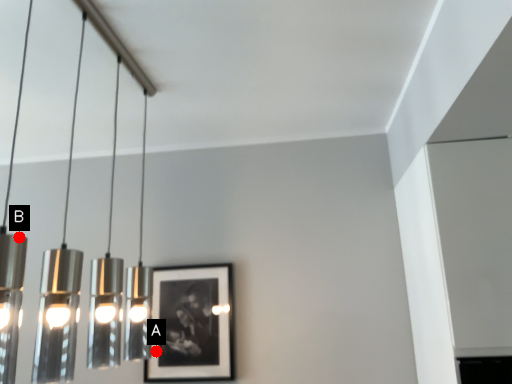
Question: Two points are circled on the image, labeled by A and B beside each circle. Which point is farther from the camera taking this photo?

Choices:
 (A) A is further
 (B) B is further

Answer: (B)